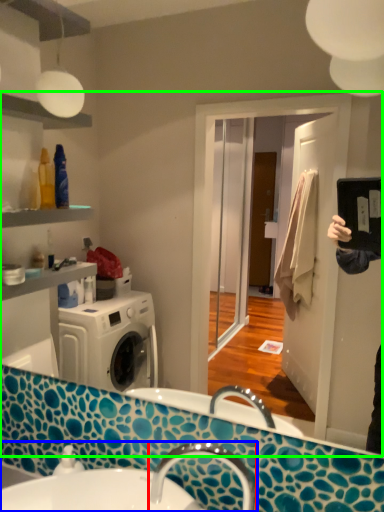
Question: Which object is positioned closest to tap (highlighted by a red box)? Select from sink (highlighted by a blue box) and mirror (highlighted by a green box).

Choices:
 (A) sink
 (B) mirror

Answer: (A)